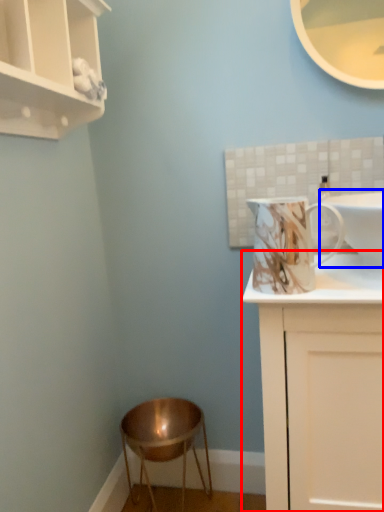
Question: Which object is further to the camera taking this photo, cabinetry (highlighted by a red box) or sink (highlighted by a blue box)?

Choices:
 (A) cabinetry
 (B) sink

Answer: (B)